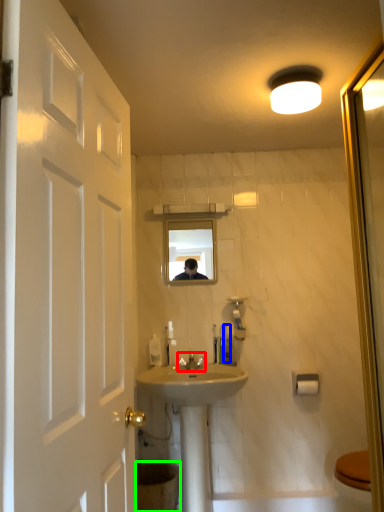
Question: Which object is the closest to the tap (highlighted by a red box)? Choose among these: toiletry (highlighted by a blue box) or toilet bowl (highlighted by a green box).

Choices:
 (A) toiletry
 (B) toilet bowl

Answer: (A)